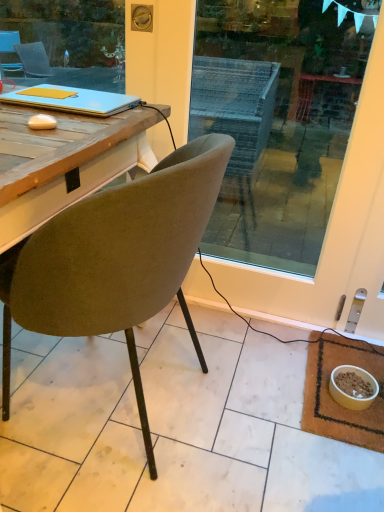
Question: Is velvet olive chair at center located within matte blue laptop at upper left?

Choices:
 (A) yes
 (B) no

Answer: (B)

Question: Considering the relative sizes of matte blue laptop at upper left and velvet olive chair at center in the image provided, is matte blue laptop at upper left shorter than velvet olive chair at center?

Choices:
 (A) yes
 (B) no

Answer: (A)

Question: From the image's perspective, is matte blue laptop at upper left beneath velvet olive chair at center?

Choices:
 (A) yes
 (B) no

Answer: (B)

Question: Is matte blue laptop at upper left turned away from velvet olive chair at center?

Choices:
 (A) no
 (B) yes

Answer: (B)

Question: Considering the relative sizes of matte blue laptop at upper left and velvet olive chair at center in the image provided, is matte blue laptop at upper left smaller than velvet olive chair at center?

Choices:
 (A) no
 (B) yes

Answer: (B)

Question: From a real-world perspective, is matte blue laptop at upper left under velvet olive chair at center?

Choices:
 (A) yes
 (B) no

Answer: (B)

Question: From a real-world perspective, is matte blue laptop at upper left under brown woven mat at lower right?

Choices:
 (A) yes
 (B) no

Answer: (B)

Question: Can we say matte blue laptop at upper left lies outside brown woven mat at lower right?

Choices:
 (A) yes
 (B) no

Answer: (A)

Question: Is matte blue laptop at upper left placed right next to brown woven mat at lower right?

Choices:
 (A) yes
 (B) no

Answer: (B)

Question: Can you confirm if matte blue laptop at upper left is wider than brown woven mat at lower right?

Choices:
 (A) yes
 (B) no

Answer: (B)

Question: Considering the relative positions of matte blue laptop at upper left and brown woven mat at lower right in the image provided, is matte blue laptop at upper left behind brown woven mat at lower right?

Choices:
 (A) no
 (B) yes

Answer: (A)

Question: Is matte blue laptop at upper left thinner than brown woven mat at lower right?

Choices:
 (A) yes
 (B) no

Answer: (A)

Question: Is yellow matte bowl at lower right inside matte blue laptop at upper left?

Choices:
 (A) no
 (B) yes

Answer: (A)